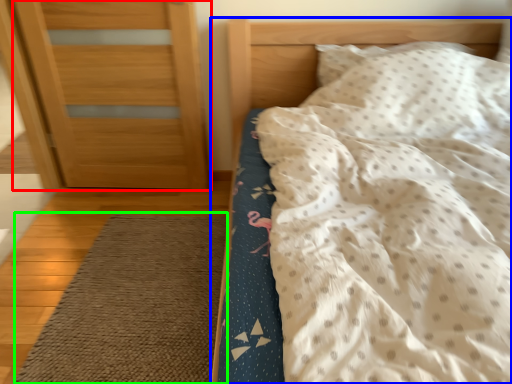
Question: Based on their relative distances, which object is nearer to door (highlighted by a red box)? Choose from bed (highlighted by a blue box) and doormat (highlighted by a green box).

Choices:
 (A) bed
 (B) doormat

Answer: (A)